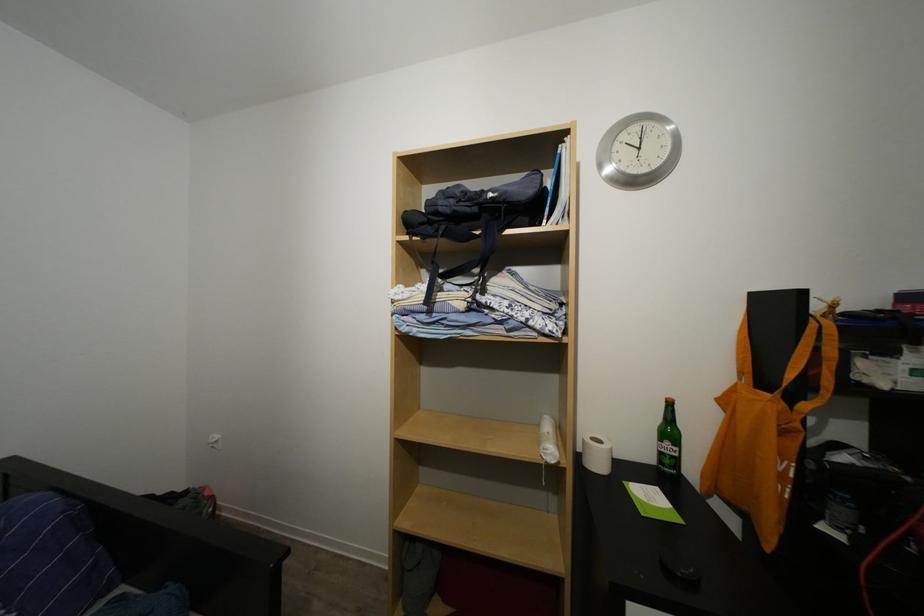
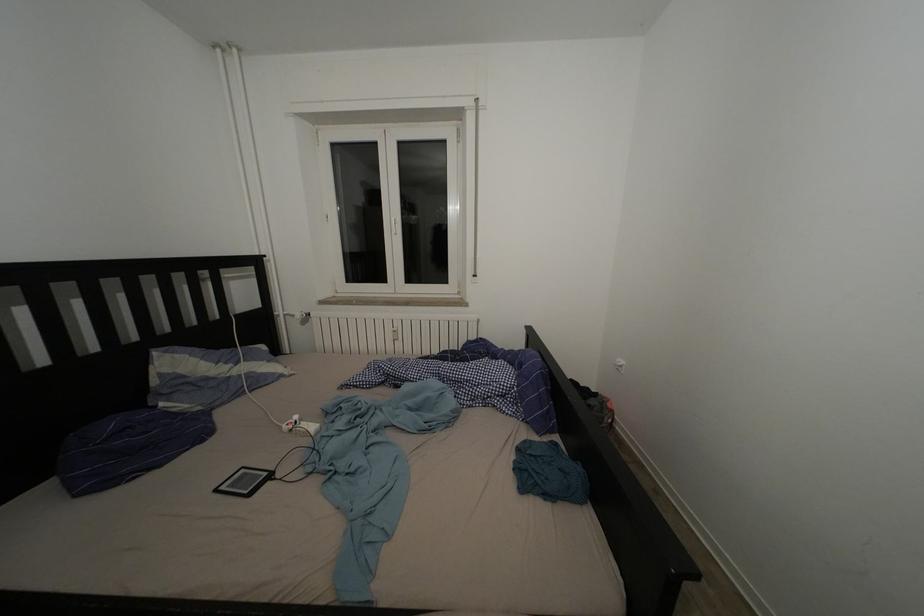
Question: The camera is either moving clockwise (left) or counter-clockwise (right) around the object. The first image is from the beginning of the video and the second image is from the end. Is the camera moving left or right when shooting the video?

Choices:
 (A) Left
 (B) Right

Answer: (B)